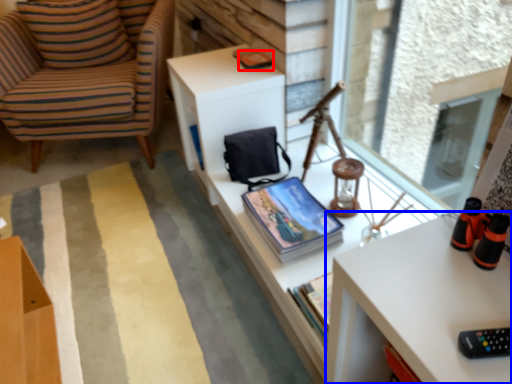
Question: Which object is closer to the camera taking this photo, magazine (highlighted by a red box) or desk (highlighted by a blue box)?

Choices:
 (A) magazine
 (B) desk

Answer: (B)